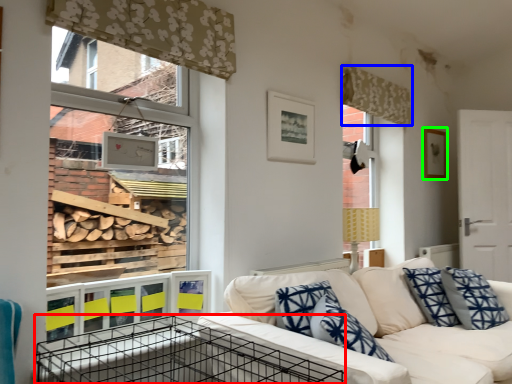
Question: Based on their relative distances, which object is farther from crate (highlighted by a red box)? Choose from curtain (highlighted by a blue box) and picture frame (highlighted by a green box).

Choices:
 (A) curtain
 (B) picture frame

Answer: (B)